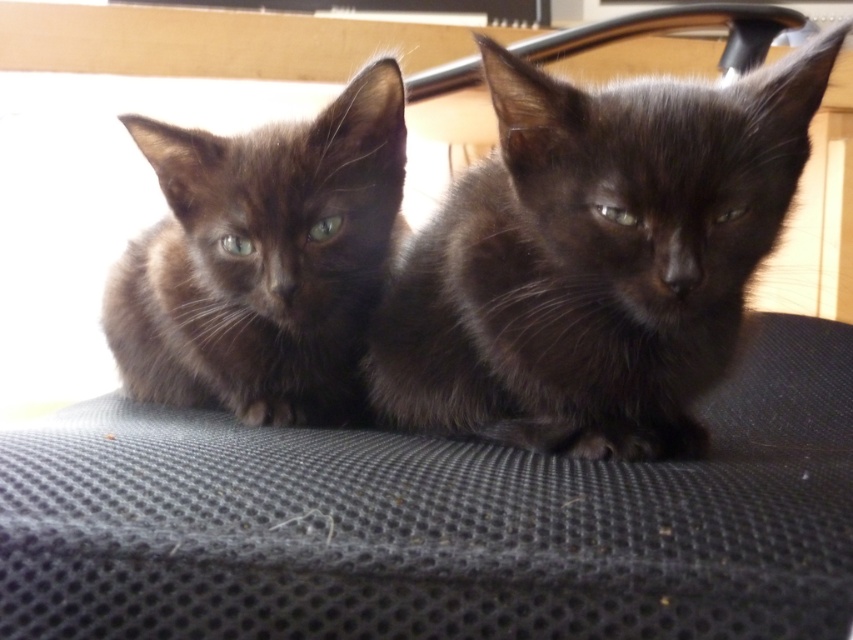
Consider the image. You are a cat owner who wants to place a small toy between the shiny black kitten at center and the shiny black kitten at left. Which kitten will the toy be closer to if you place it exactly halfway between them?

The toy will be closer to the shiny black kitten at left because the shiny black kitten at center is larger, so the distance between them would require the toy to be placed nearer to the smaller kitten to maintain the halfway point.

You are a photographer trying to capture a closeup of the shiny black kitten at center and the shiny black kitten at left. Which kitten will appear larger in the photo?

The shiny black kitten at center will appear larger in the photo because it is closer to the viewer than the shiny black kitten at left.

You are a cat owner who wants to ensure both kittens have enough space to stretch comfortably. Given that the shiny black kitten at center is smaller than the shiny black kitten at left, which kitten requires a larger area to accommodate its size?

The shiny black kitten at left requires a larger area because it is taller than the shiny black kitten at center.